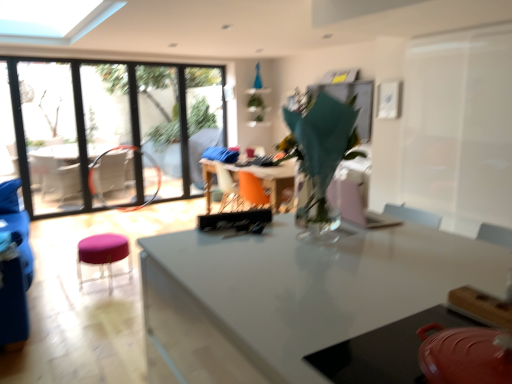
Question: Can matte red pot at lower right, the 2th table when ordered from top to bottom, be found inside transparent glass window at left?

Choices:
 (A) no
 (B) yes

Answer: (A)

Question: Is transparent glass window at left wider than matte red pot at lower right, the 2th table when ordered from top to bottom?

Choices:
 (A) no
 (B) yes

Answer: (A)

Question: Is transparent glass window at left shorter than matte red pot at lower right, the 2th table when ordered from top to bottom?

Choices:
 (A) no
 (B) yes

Answer: (A)

Question: Considering the relative sizes of transparent glass window at left and matte red pot at lower right, the 2th table when ordered from top to bottom, in the image provided, is transparent glass window at left thinner than matte red pot at lower right, the 2th table when ordered from top to bottom,?

Choices:
 (A) no
 (B) yes

Answer: (B)

Question: From the image's perspective, is transparent glass window at left under matte red pot at lower right, the 2th table when ordered from top to bottom?

Choices:
 (A) yes
 (B) no

Answer: (B)

Question: In the image, is transparent plastic screen door at right positioned in front of or behind translucent glass vase at center?

Choices:
 (A) front
 (B) behind

Answer: (B)

Question: From a real-world perspective, is transparent plastic screen door at right physically located above or below translucent glass vase at center?

Choices:
 (A) above
 (B) below

Answer: (A)

Question: From their relative heights in the image, would you say transparent plastic screen door at right is taller or shorter than translucent glass vase at center?

Choices:
 (A) short
 (B) tall

Answer: (B)

Question: In terms of width, does transparent plastic screen door at right look wider or thinner when compared to translucent glass vase at center?

Choices:
 (A) thin
 (B) wide

Answer: (A)

Question: From the image's perspective, is transparent glass vase at center, the first table from the top, above or below matte red pot at lower right, the 2th table when ordered from top to bottom?

Choices:
 (A) above
 (B) below

Answer: (A)

Question: Considering the positions of transparent glass vase at center, the first table from the top, and matte red pot at lower right, the 2th table when ordered from top to bottom, in the image, is transparent glass vase at center, the first table from the top, bigger or smaller than matte red pot at lower right, the 2th table when ordered from top to bottom,?

Choices:
 (A) small
 (B) big

Answer: (B)

Question: Considering the positions of transparent glass vase at center, arranged as the second table when ordered from the bottom, and matte red pot at lower right, the 2th table when ordered from top to bottom, in the image, is transparent glass vase at center, arranged as the second table when ordered from the bottom, taller or shorter than matte red pot at lower right, the 2th table when ordered from top to bottom,?

Choices:
 (A) short
 (B) tall

Answer: (B)

Question: Is point (208, 203) positioned closer to the camera than point (339, 365)?

Choices:
 (A) closer
 (B) farther

Answer: (B)

Question: In terms of height, does translucent glass vase at center look taller or shorter compared to purple fabric stool at lower left?

Choices:
 (A) tall
 (B) short

Answer: (A)

Question: Is translucent glass vase at center wider or thinner than purple fabric stool at lower left?

Choices:
 (A) wide
 (B) thin

Answer: (B)